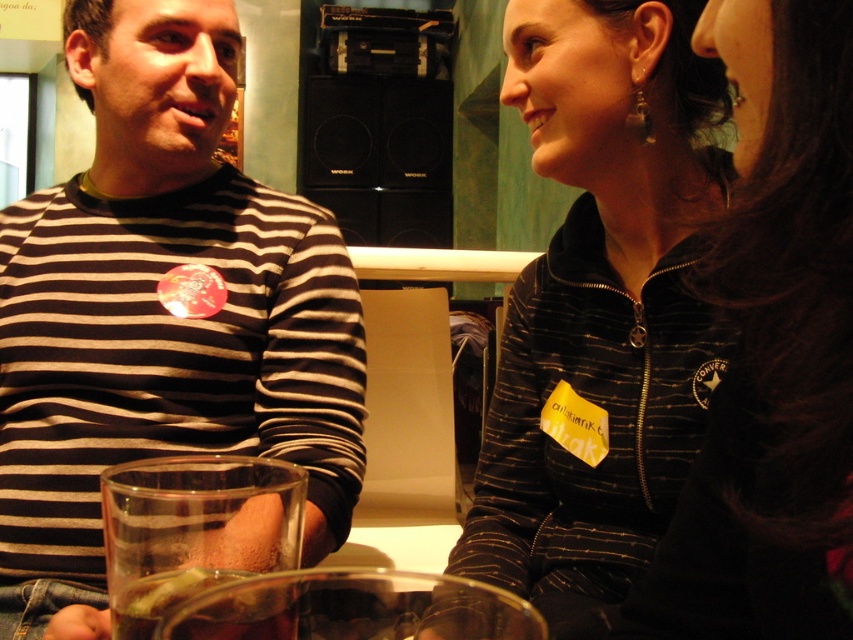
You are at a social event and want to grab a drink quickly. There are two glasses on the table in front of you. Which glass, the clear glass at lower left or the translucent glass at lower left, is easier to see the liquid level in?

The clear glass at lower left is easier to see the liquid level in because it is closer to the viewer than the translucent glass at lower left.

You are at a party and want to place a new drink on the table. The new drink requires a space wider than the clear glass at lower left. Can the black striped jacket at upper right provide enough space for it?

The black striped jacket at upper right is wider than the clear glass at lower left, so yes, it can provide enough space for the drink that requires a space wider than the clear glass at lower left.

You are standing in the same room as the people in the image. You want to walk from the point at coordinate point (291,531) to the point at coordinate point (129,611). Which direction should you move in to get there?

You should move towards the lower right direction to reach point (129,611) from point (291,531).